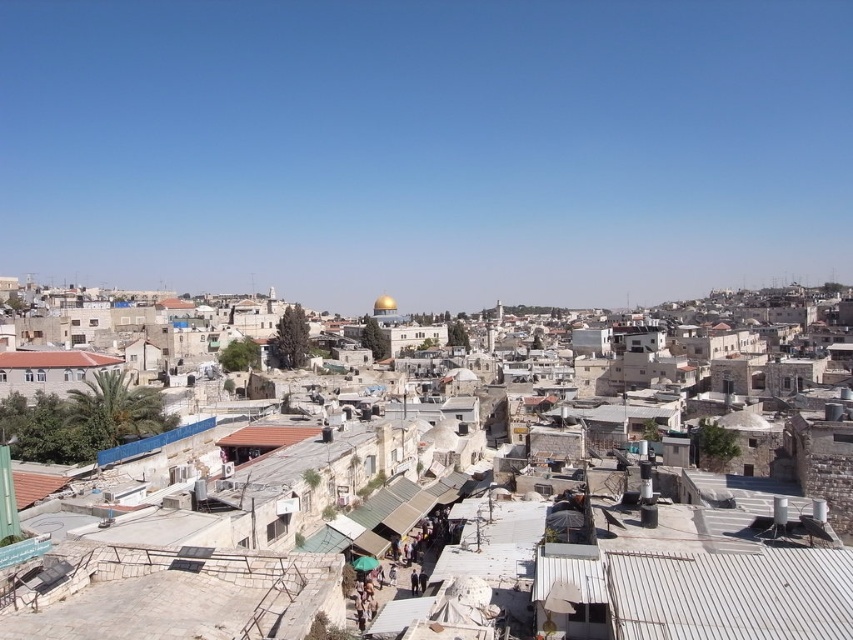
Question: Considering the relative positions of stone buildings at center and brown tile roof at lower left in the image provided, where is stone buildings at center located with respect to brown tile roof at lower left?

Choices:
 (A) above
 (B) below

Answer: (B)

Question: Is stone buildings at center to the left of brown tile roof at lower left from the viewer's perspective?

Choices:
 (A) no
 (B) yes

Answer: (A)

Question: Does stone buildings at center have a greater width compared to brown tile roof at lower left?

Choices:
 (A) yes
 (B) no

Answer: (A)

Question: Which point appears farthest from the camera in this image?

Choices:
 (A) [x=825, y=621]
 (B) [x=99, y=358]

Answer: (B)

Question: Which of the following is the farthest from the observer?

Choices:
 (A) pyautogui.click(x=16, y=368)
 (B) pyautogui.click(x=718, y=636)

Answer: (A)

Question: Which object appears closest to the camera in this image?

Choices:
 (A) brown tile roof at lower left
 (B) stone buildings at center

Answer: (B)